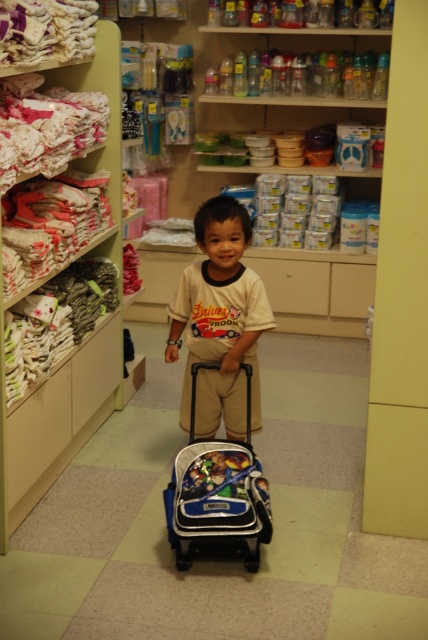
You are a store employee who needs to place a new shelf between the two points labeled as point [223,291] and point [178,538]. Which point should the shelf be closer to in order to be nearer to the child?

The shelf should be placed closer to point [178,538] because point [223,291] is further to the viewer than point [178,538], so placing it closer to the latter would position it nearer to the child.

You are a parent shopping for a gift for a toddler. You see the beige cotton shirt at center and the blue fabric backpack at center in the store. Which item is positioned higher on the shelf?

The beige cotton shirt at center is located above the blue fabric backpack at center, so it is positioned higher on the shelf.